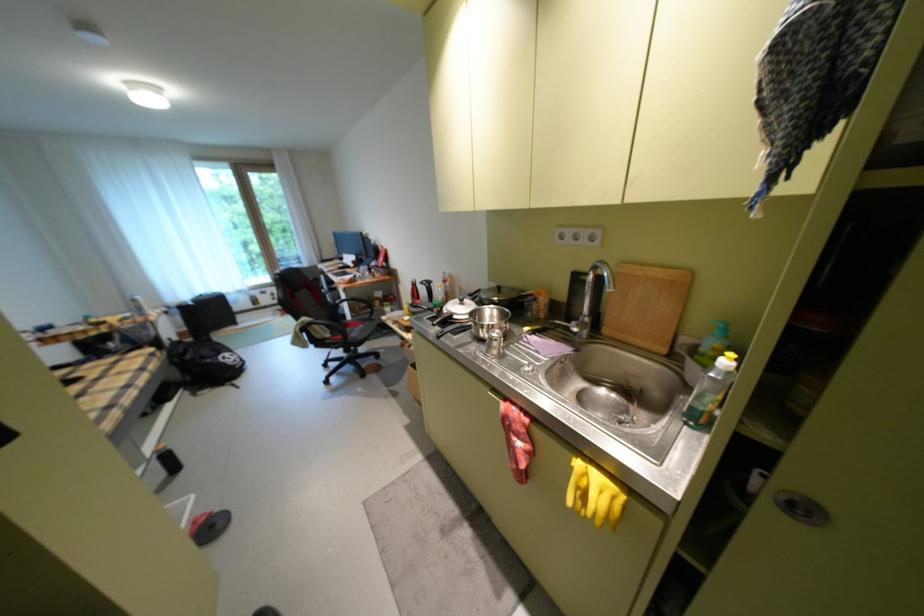
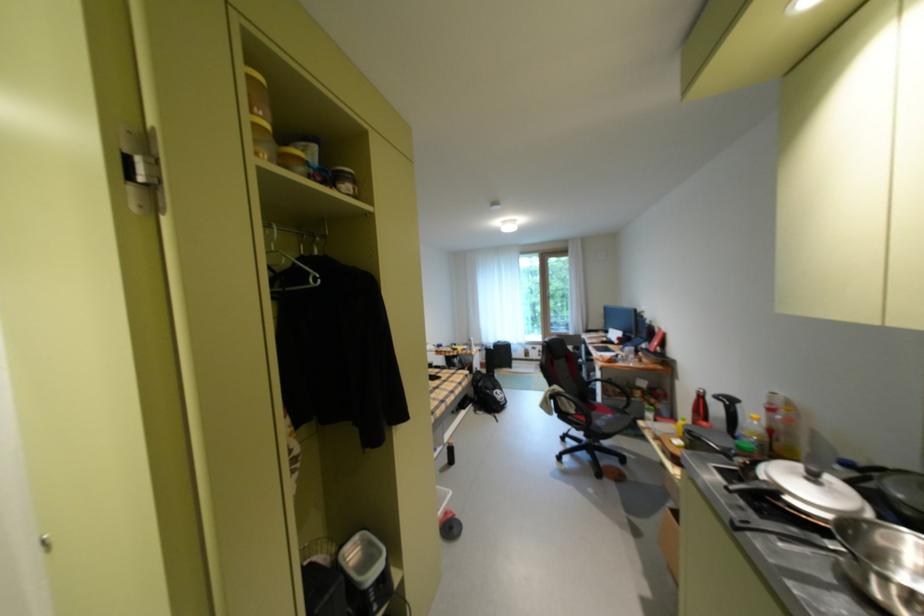
Find the pixel in the second image that matches pixel 458 326 in the first image.

(775, 507)